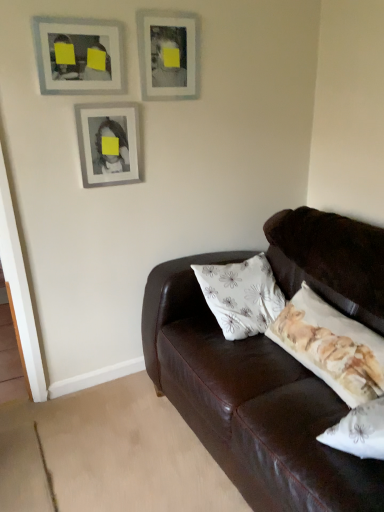
Question: From a real-world perspective, is matte silver picture frame at center, which is counted as the second picture frame, starting from the left, positioned over matte gray picture frame at upper left, which ranks as the 3th picture frame in right-to-left order, based on gravity?

Choices:
 (A) yes
 (B) no

Answer: (B)

Question: Is the position of matte silver picture frame at center, which is counted as the second picture frame, starting from the left, more distant than that of matte gray picture frame at upper left, positioned as the first picture frame in left-to-right order?

Choices:
 (A) no
 (B) yes

Answer: (B)

Question: Is matte silver picture frame at center, which is counted as the second picture frame, starting from the left, at the left side of matte gray picture frame at upper left, positioned as the first picture frame in left-to-right order?

Choices:
 (A) yes
 (B) no

Answer: (B)

Question: Is matte silver picture frame at center, which is counted as the second picture frame, starting from the left, to the right of matte gray picture frame at upper left, which ranks as the 3th picture frame in right-to-left order, from the viewer's perspective?

Choices:
 (A) no
 (B) yes

Answer: (B)

Question: Is matte silver picture frame at center, which is counted as the second picture frame, starting from the right, far from matte gray picture frame at upper left, positioned as the first picture frame in left-to-right order?

Choices:
 (A) yes
 (B) no

Answer: (B)

Question: Is matte silver picture frame at center, which is counted as the second picture frame, starting from the left, outside of matte gray picture frame at upper left, positioned as the first picture frame in left-to-right order?

Choices:
 (A) yes
 (B) no

Answer: (A)

Question: Can you confirm if matte silver picture frame at upper center, which is the third picture frame in left-to-right order, is wider than matte gray picture frame at upper left, positioned as the first picture frame in left-to-right order?

Choices:
 (A) no
 (B) yes

Answer: (B)

Question: Can you confirm if matte silver picture frame at upper center, which is the 1th picture frame from right to left, is taller than matte gray picture frame at upper left, which ranks as the 3th picture frame in right-to-left order?

Choices:
 (A) no
 (B) yes

Answer: (B)

Question: Would you say matte silver picture frame at upper center, which is the third picture frame in left-to-right order, contains matte gray picture frame at upper left, positioned as the first picture frame in left-to-right order?

Choices:
 (A) no
 (B) yes

Answer: (A)

Question: Is matte silver picture frame at upper center, which is the 1th picture frame from right to left, facing towards matte gray picture frame at upper left, positioned as the first picture frame in left-to-right order?

Choices:
 (A) no
 (B) yes

Answer: (A)

Question: Can we say matte silver picture frame at upper center, which is the third picture frame in left-to-right order, lies outside matte gray picture frame at upper left, positioned as the first picture frame in left-to-right order?

Choices:
 (A) yes
 (B) no

Answer: (A)

Question: Does matte silver picture frame at upper center, which is the third picture frame in left-to-right order, come in front of matte gray picture frame at upper left, positioned as the first picture frame in left-to-right order?

Choices:
 (A) yes
 (B) no

Answer: (B)

Question: Is matte silver picture frame at upper center, which is the third picture frame in left-to-right order, far from matte silver picture frame at center, which is counted as the second picture frame, starting from the right?

Choices:
 (A) yes
 (B) no

Answer: (B)